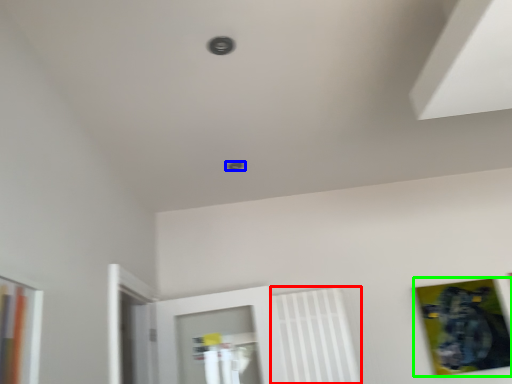
Question: Which object is positioned closest to radiator (highlighted by a red box)? Select from hole (highlighted by a blue box) and picture frame (highlighted by a green box).

Choices:
 (A) hole
 (B) picture frame

Answer: (B)